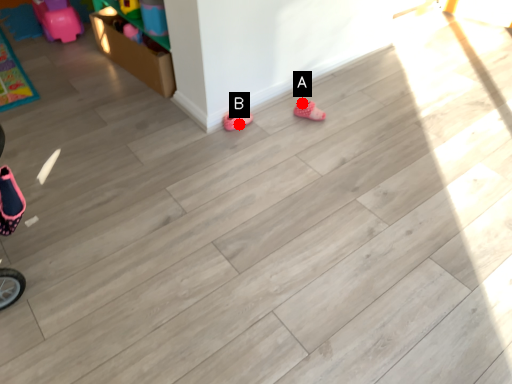
Question: Two points are circled on the image, labeled by A and B beside each circle. Which point is further to the camera?

Choices:
 (A) A is further
 (B) B is further

Answer: (A)